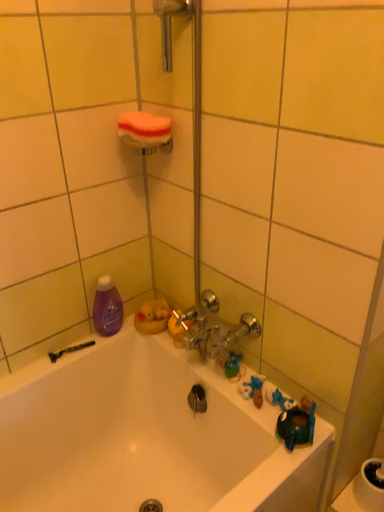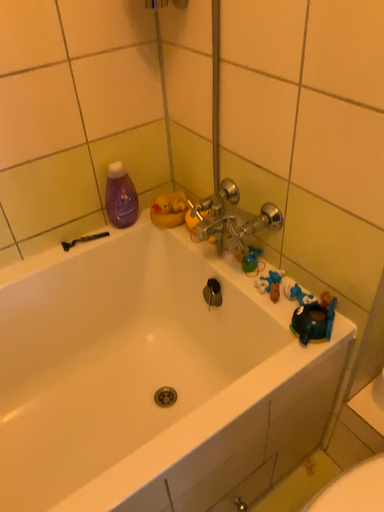
Question: How did the camera likely rotate when shooting the video?

Choices:
 (A) rotated downward
 (B) rotated upward

Answer: (A)